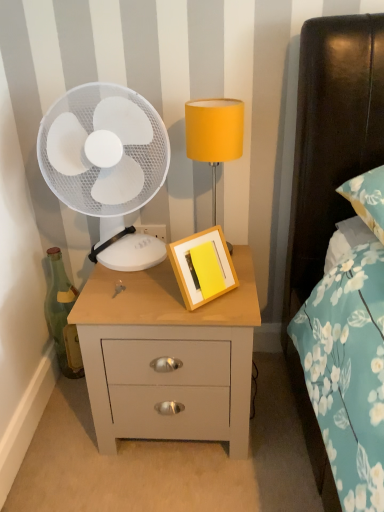
Find the location of a particular element. wooden picture frame at center is located at coordinates (194, 268).

Where is `yellow fabric lampshade at upper center`? yellow fabric lampshade at upper center is located at coordinates (214, 134).

What's the angular difference between yellow fabric lampshade at upper center and wooden picture frame at center's facing directions?

43.2 degrees.

Can you see yellow fabric lampshade at upper center touching wooden picture frame at center?

yellow fabric lampshade at upper center is not next to wooden picture frame at center, and they're not touching.

This screenshot has height=512, width=384. In the image, there is a wooden picture frame at center. Find the location of `bedside lamp above it (from the image's perspective)`. bedside lamp above it (from the image's perspective) is located at coordinates (214, 134).

Could you tell me if yellow fabric lampshade at upper center is facing wooden picture frame at center?

Yes, yellow fabric lampshade at upper center faces towards wooden picture frame at center.

Which is more to the right, green glass bottle at left or light wood/finish nightstand at center?

light wood/finish nightstand at center is more to the right.

In the scene shown: Looking at the image, does green glass bottle at left seem bigger or smaller compared to light wood/finish nightstand at center?

Considering their sizes, green glass bottle at left takes up less space than light wood/finish nightstand at center.

Is light wood/finish nightstand at center located within green glass bottle at left?

No, light wood/finish nightstand at center is not a part of green glass bottle at left.

At what (x,y) coordinates should I click in order to perform the action: click on nightstand that appears in front of the green glass bottle at left. Please return your answer as a coordinate pair (x, y). Looking at the image, I should click on (167, 356).

From the picture: Is white plastic fan at left oriented away from light wood/finish nightstand at center?

No, white plastic fan at left is not facing away from light wood/finish nightstand at center.

Considering the sizes of white plastic fan at left and light wood/finish nightstand at center in the image, is white plastic fan at left wider or thinner than light wood/finish nightstand at center?

white plastic fan at left is thinner than light wood/finish nightstand at center.

Can you confirm if white plastic fan at left is positioned to the left of light wood/finish nightstand at center?

Yes, white plastic fan at left is to the left of light wood/finish nightstand at center.

Is point (200, 103) closer or farther from the camera than point (207, 390)?

Point (200, 103) appears to be closer to the viewer than point (207, 390).

Is yellow fabric lampshade at upper center in front of or behind light wood/finish nightstand at center in the image?

yellow fabric lampshade at upper center is positioned farther from the viewer than light wood/finish nightstand at center.

I want to click on nightstand below the yellow fabric lampshade at upper center (from the image's perspective), so click(167, 356).

Looking at this image, which of these two, white plastic fan at left or green glass bottle at left, is bigger?

With larger size is white plastic fan at left.

Identify the location of mechanical fan in front of the green glass bottle at left. The height and width of the screenshot is (512, 384). (103, 152).

Is white plastic fan at left not near green glass bottle at left?

white plastic fan at left is near green glass bottle at left, not far away.

Is white plastic fan at left turned away from green glass bottle at left?

That's not correct — white plastic fan at left is not looking away from green glass bottle at left.

Does green glass bottle at left have a greater height compared to wooden picture frame at center?

Correct, green glass bottle at left is much taller as wooden picture frame at center.

Would you say wooden picture frame at center is part of green glass bottle at left's contents?

No, green glass bottle at left does not contain wooden picture frame at center.

From a real-world perspective, is green glass bottle at left below wooden picture frame at center?

Indeed, from a real-world perspective, green glass bottle at left is positioned beneath wooden picture frame at center.

Which is more to the right, green glass bottle at left or wooden picture frame at center?

wooden picture frame at center is more to the right.

From the image's perspective, which is above, light wood/finish nightstand at center or green glass bottle at left?

green glass bottle at left, from the image's perspective.

Is point (103, 327) closer to camera compared to point (74, 330)?

Yes, point (103, 327) is in front of point (74, 330).

How different are the orientations of light wood/finish nightstand at center and green glass bottle at left in degrees?

The angle between the facing direction of light wood/finish nightstand at center and the facing direction of green glass bottle at left is 3.36 degrees.

From a real-world perspective, is light wood/finish nightstand at center physically located above or below green glass bottle at left?

Clearly, from a real-world perspective, light wood/finish nightstand at center is below green glass bottle at left.

What are the coordinates of `picture frame in front of the yellow fabric lampshade at upper center` in the screenshot? It's located at (194, 268).

Find the location of a particular element. The width and height of the screenshot is (384, 512). nightstand that appears below the green glass bottle at left (from the image's perspective) is located at coordinates (167, 356).

When comparing their distances from wooden picture frame at center, does yellow fabric lampshade at upper center or green glass bottle at left seem closer?

yellow fabric lampshade at upper center is positioned closer to the anchor wooden picture frame at center.

From the image, which object appears to be farther from yellow fabric lampshade at upper center, green glass bottle at left or light wood/finish nightstand at center?

green glass bottle at left is positioned further to the anchor yellow fabric lampshade at upper center.

When comparing their distances from wooden picture frame at center, does green glass bottle at left or white plastic fan at left seem further?

green glass bottle at left.

Considering their positions, is white plastic fan at left positioned closer to light wood/finish nightstand at center than green glass bottle at left?

white plastic fan at left is closer to light wood/finish nightstand at center.

From the image, which object appears to be nearer to wooden picture frame at center, light wood/finish nightstand at center or green glass bottle at left?

The object closer to wooden picture frame at center is light wood/finish nightstand at center.

From the image, which object appears to be nearer to green glass bottle at left, light wood/finish nightstand at center or white plastic fan at left?

Among the two, white plastic fan at left is located nearer to green glass bottle at left.

Considering their positions, is light wood/finish nightstand at center positioned further to white plastic fan at left than wooden picture frame at center?

wooden picture frame at center is positioned further to the anchor white plastic fan at left.

In the scene shown: Considering their positions, is yellow fabric lampshade at upper center positioned further to wooden picture frame at center than light wood/finish nightstand at center?

The object further to wooden picture frame at center is yellow fabric lampshade at upper center.

This screenshot has height=512, width=384. What are the coordinates of `nightstand between green glass bottle at left and wooden picture frame at center from left to right` in the screenshot? It's located at (167, 356).

Locate an element on the screen. The height and width of the screenshot is (512, 384). picture frame located between white plastic fan at left and yellow fabric lampshade at upper center in the left-right direction is located at coordinates (194, 268).

The height and width of the screenshot is (512, 384). Find the location of `bottle that lies between white plastic fan at left and light wood/finish nightstand at center from top to bottom`. bottle that lies between white plastic fan at left and light wood/finish nightstand at center from top to bottom is located at coordinates (63, 317).

This screenshot has height=512, width=384. Identify the location of bedside lamp between white plastic fan at left and light wood/finish nightstand at center from top to bottom. (214, 134).